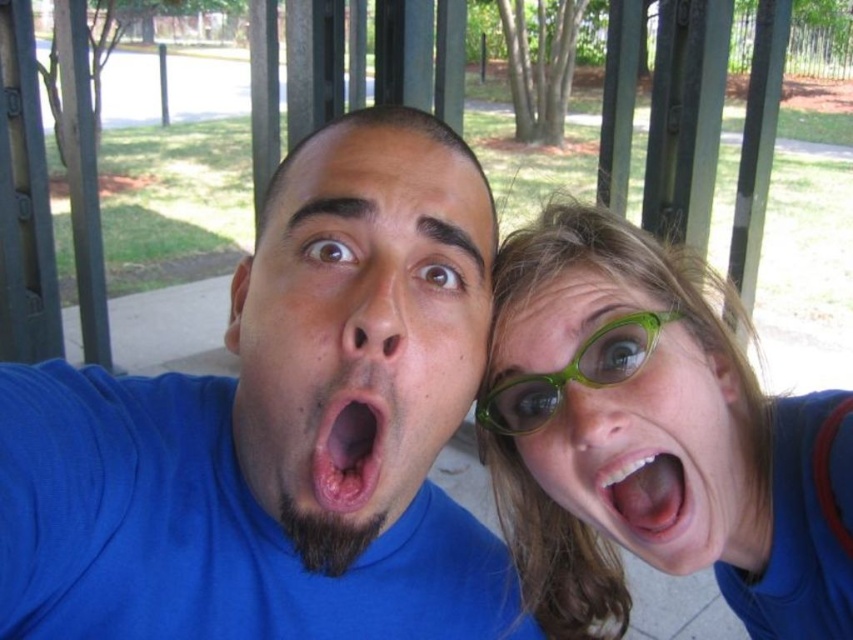
Who is higher up, green plastic glasses at upper right or pink glossy lips at center?

pink glossy lips at center

Who is more forward, (811, 442) or (679, 536)?

Positioned in front is point (679, 536).

Is point (802, 518) closer to camera compared to point (671, 472)?

No, it is behind (671, 472).

You are a GUI agent. You are given a task and a screenshot of the screen. Output one action in this format:
    pyautogui.click(x=<x>, y=<y>)
    Task: Click on the green plastic glasses at upper right
    This screenshot has width=853, height=640.
    Given the screenshot: What is the action you would take?
    pyautogui.click(x=653, y=440)

Which is more to the right, matte blue shirt at center or pink glossy lips at center?

pink glossy lips at center

Consider the image. Who is more forward, (283, 452) or (685, 484)?

Point (283, 452) is in front.

Image resolution: width=853 pixels, height=640 pixels. What are the coordinates of `matte blue shirt at center` in the screenshot? It's located at (358, 326).

I want to click on matte blue shirt at center, so click(x=358, y=326).

Between pink glossy lips at center and pink flesh-colored lips at center, which one appears on the right side from the viewer's perspective?

From the viewer's perspective, pink glossy lips at center appears more on the right side.

Does pink glossy lips at center appear over pink flesh-colored lips at center?

Incorrect, pink glossy lips at center is not positioned above pink flesh-colored lips at center.

At what (x,y) coordinates should I click in order to perform the action: click on pink glossy lips at center. Please return your answer as a coordinate pair (x, y). Looking at the image, I should click on (647, 499).